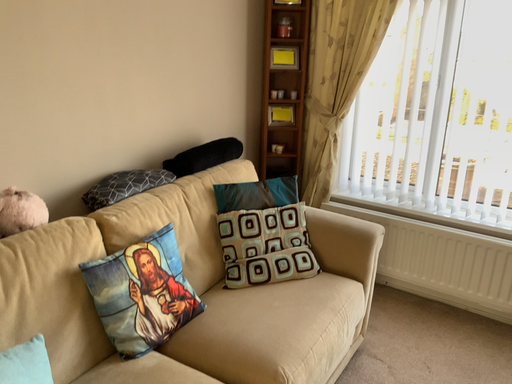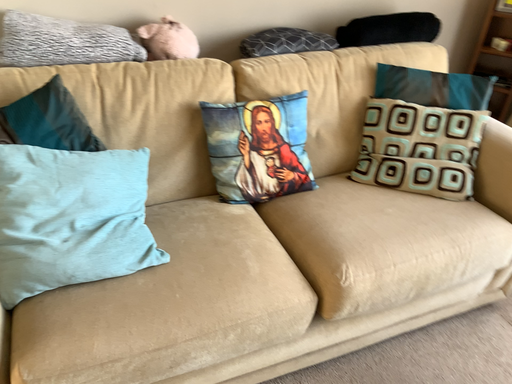
Question: How did the camera likely rotate when shooting the video?

Choices:
 (A) rotated upward
 (B) rotated downward

Answer: (B)